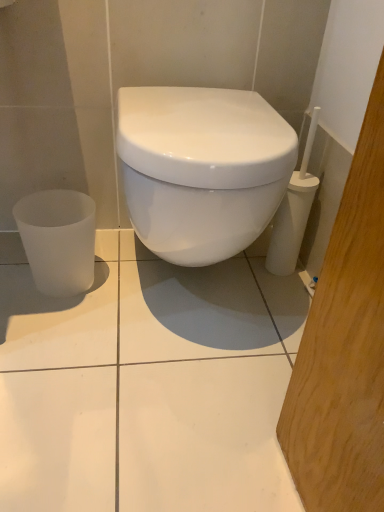
Where is `free spot in front of white glossy toilet at center`? free spot in front of white glossy toilet at center is located at coordinates (153, 407).